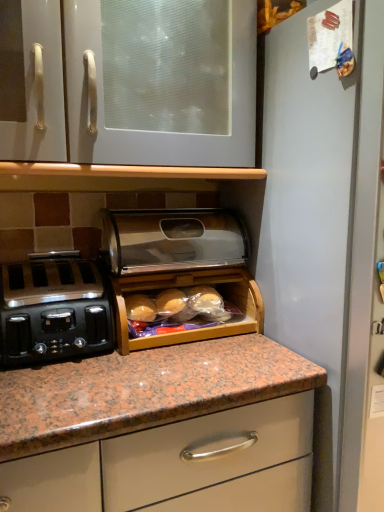
Question: Which direction should I rotate to face polished stainless steel bread box at center, the 2th appliance ordered from the bottom, — up or down?

Choices:
 (A) up
 (B) down

Answer: (A)

Question: Which direction should I rotate to face wooden bread box at center, which is the first appliance from bottom to top, — up or down?

Choices:
 (A) down
 (B) up

Answer: (A)

Question: From a real-world perspective, is polished stainless steel bread box at center, the 2th appliance ordered from the bottom, located higher than white glossy cabinet at upper center?

Choices:
 (A) yes
 (B) no

Answer: (B)

Question: Would you say white glossy cabinet at upper center is part of polished stainless steel bread box at center, which appears as the 1th appliance when viewed from the top,'s contents?

Choices:
 (A) no
 (B) yes

Answer: (A)

Question: From the image's perspective, would you say polished stainless steel bread box at center, which appears as the 1th appliance when viewed from the top, is shown under white glossy cabinet at upper center?

Choices:
 (A) yes
 (B) no

Answer: (A)

Question: Is polished stainless steel bread box at center, the 2th appliance ordered from the bottom, taller than white glossy cabinet at upper center?

Choices:
 (A) yes
 (B) no

Answer: (B)

Question: Could you tell me if polished stainless steel bread box at center, the 2th appliance ordered from the bottom, is turned towards white glossy cabinet at upper center?

Choices:
 (A) yes
 (B) no

Answer: (B)

Question: Considering the relative sizes of polished stainless steel bread box at center, the 2th appliance ordered from the bottom, and white glossy cabinet at upper center in the image provided, is polished stainless steel bread box at center, the 2th appliance ordered from the bottom, thinner than white glossy cabinet at upper center?

Choices:
 (A) yes
 (B) no

Answer: (A)

Question: From a real-world perspective, is white glossy cabinet at upper center beneath satin black toaster at left?

Choices:
 (A) no
 (B) yes

Answer: (A)

Question: Is white glossy cabinet at upper center facing away from satin black toaster at left?

Choices:
 (A) yes
 (B) no

Answer: (B)

Question: From the image's perspective, does white glossy cabinet at upper center appear lower than satin black toaster at left?

Choices:
 (A) yes
 (B) no

Answer: (B)

Question: Is white glossy cabinet at upper center located outside satin black toaster at left?

Choices:
 (A) yes
 (B) no

Answer: (A)

Question: Does white glossy cabinet at upper center come behind satin black toaster at left?

Choices:
 (A) yes
 (B) no

Answer: (B)

Question: Is satin black toaster at left located within white glossy cabinet at upper center?

Choices:
 (A) no
 (B) yes

Answer: (A)

Question: From a real-world perspective, is wooden bread box at center, which is the first appliance from bottom to top, on top of polished stainless steel bread box at center, the 2th appliance ordered from the bottom?

Choices:
 (A) yes
 (B) no

Answer: (B)